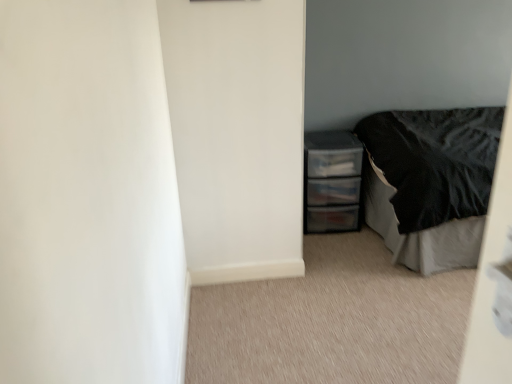
Measure the distance between point (331,165) and camera.

Point (331,165) and camera are 2.64 meters apart.

What do you see at coordinates (332, 181) in the screenshot? I see `clear plastic drawers at right` at bounding box center [332, 181].

What is the approximate width of clear plastic drawers at right?

clear plastic drawers at right is 16.37 inches wide.

The width and height of the screenshot is (512, 384). I want to click on clear plastic drawers at right, so click(332, 181).

The height and width of the screenshot is (384, 512). I want to click on black satin bed at right, so click(x=430, y=183).

This screenshot has height=384, width=512. What do you see at coordinates (430, 183) in the screenshot? I see `black satin bed at right` at bounding box center [430, 183].

In order to face black satin bed at right, should I rotate leftwards or rightwards?

You should look right and rotate roughly 26.630 degrees.

The image size is (512, 384). Find the location of `clear plastic drawers at right`. clear plastic drawers at right is located at coordinates (332, 181).

Looking at this image, considering the relative positions of black satin bed at right and clear plastic drawers at right in the image provided, is black satin bed at right to the right of clear plastic drawers at right from the viewer's perspective?

Indeed, black satin bed at right is positioned on the right side of clear plastic drawers at right.

Does black satin bed at right lie behind clear plastic drawers at right?

No, the depth of black satin bed at right is less than that of clear plastic drawers at right.

Which is nearer, [394,260] or [345,162]?

Point [394,260] appears to be closer to the viewer than point [345,162].

From the image's perspective, does black satin bed at right appear higher than clear plastic drawers at right?

Indeed, from the image's perspective, black satin bed at right is shown above clear plastic drawers at right.

From a real-world perspective, is black satin bed at right positioned over clear plastic drawers at right based on gravity?

Yes, from a real-world perspective, black satin bed at right is on top of clear plastic drawers at right.

Which of these two, black satin bed at right or clear plastic drawers at right, is thinner?

With smaller width is clear plastic drawers at right.

Does black satin bed at right have a greater height compared to clear plastic drawers at right?

Correct, black satin bed at right is much taller as clear plastic drawers at right.

Is black satin bed at right bigger than clear plastic drawers at right?

Yes.

Choose the correct answer: Is black satin bed at right inside clear plastic drawers at right or outside it?

black satin bed at right is not inside clear plastic drawers at right, it's outside.

Is black satin bed at right touching clear plastic drawers at right?

No, black satin bed at right is not making contact with clear plastic drawers at right.

Based on the photo, is black satin bed at right positioned with its back to clear plastic drawers at right?

No, black satin bed at right is not facing the opposite direction of clear plastic drawers at right.

I want to click on bed in front of the clear plastic drawers at right, so click(430, 183).

Which is more to the left, clear plastic drawers at right or black satin bed at right?

clear plastic drawers at right.

Is clear plastic drawers at right further to the viewer compared to black satin bed at right?

Yes, it is.

Which point is more forward, (338, 132) or (403, 131)?

The point (403, 131) is more forward.

From the image's perspective, does clear plastic drawers at right appear higher than black satin bed at right?

No, from the image's perspective, clear plastic drawers at right is not above black satin bed at right.

From a real-world perspective, relative to black satin bed at right, is clear plastic drawers at right vertically above or below?

From a real-world perspective, clear plastic drawers at right is physically below black satin bed at right.

Is clear plastic drawers at right wider or thinner than black satin bed at right?

Clearly, clear plastic drawers at right has less width compared to black satin bed at right.

Which of these two, clear plastic drawers at right or black satin bed at right, stands taller?

black satin bed at right is taller.

Looking at the image, does clear plastic drawers at right seem bigger or smaller compared to black satin bed at right?

Considering their sizes, clear plastic drawers at right takes up less space than black satin bed at right.

Is clear plastic drawers at right inside or outside of black satin bed at right?

clear plastic drawers at right is not inside black satin bed at right, it's outside.

Is there a large distance between clear plastic drawers at right and black satin bed at right?

No, there isn't a large distance between clear plastic drawers at right and black satin bed at right.

Is clear plastic drawers at right oriented away from black satin bed at right?

No, black satin bed at right is not at the back of clear plastic drawers at right.

How far apart are clear plastic drawers at right and black satin bed at right?

They are 16.03 inches apart.

Find the location of a particular element. the chest of drawers located underneath the black satin bed at right (from a real-world perspective) is located at coordinates (332, 181).

This screenshot has height=384, width=512. I want to click on the chest of drawers that is under the black satin bed at right (from a real-world perspective), so click(x=332, y=181).

The width and height of the screenshot is (512, 384). I want to click on bed that is on the right side of clear plastic drawers at right, so click(x=430, y=183).